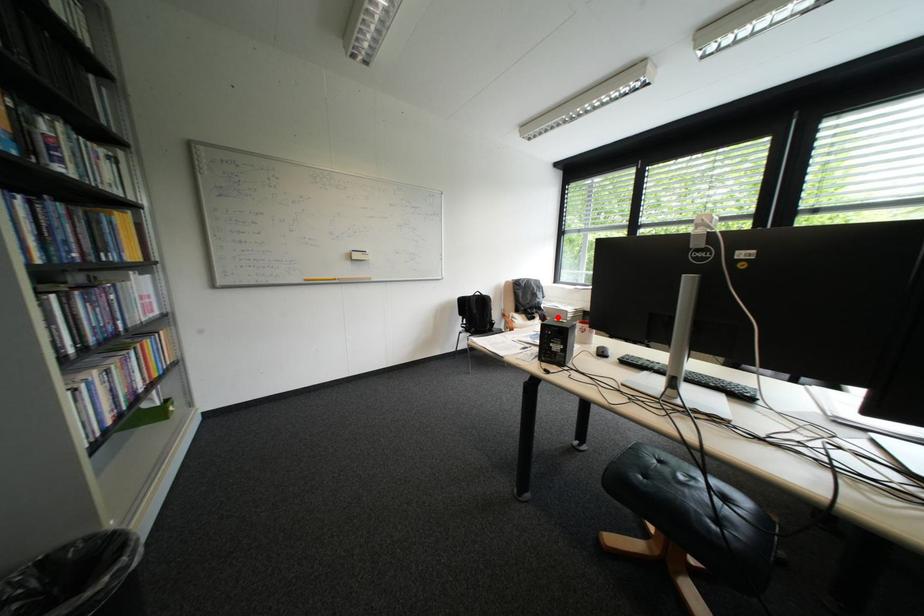
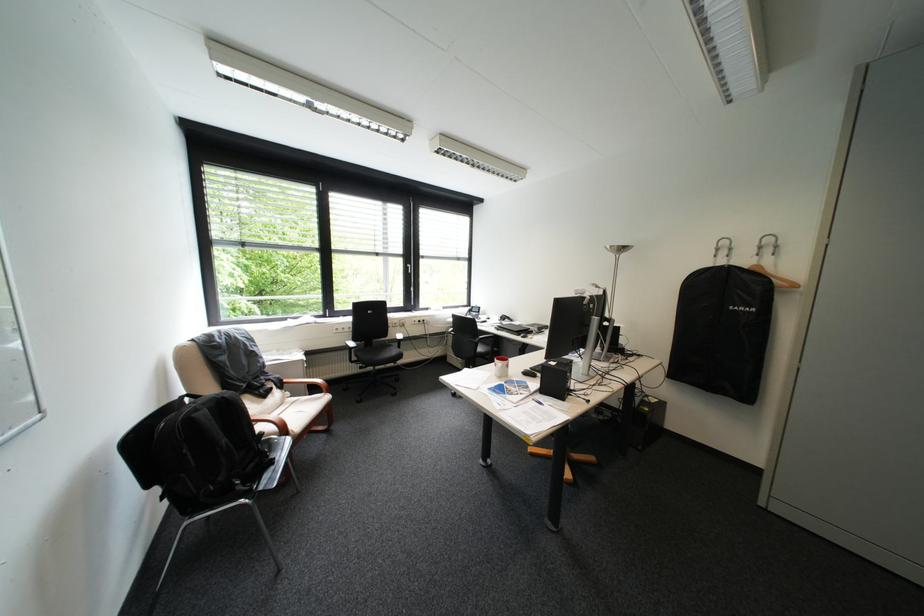
Find the pixel in the second image that matches the highlighted location in the first image.

(294, 381)